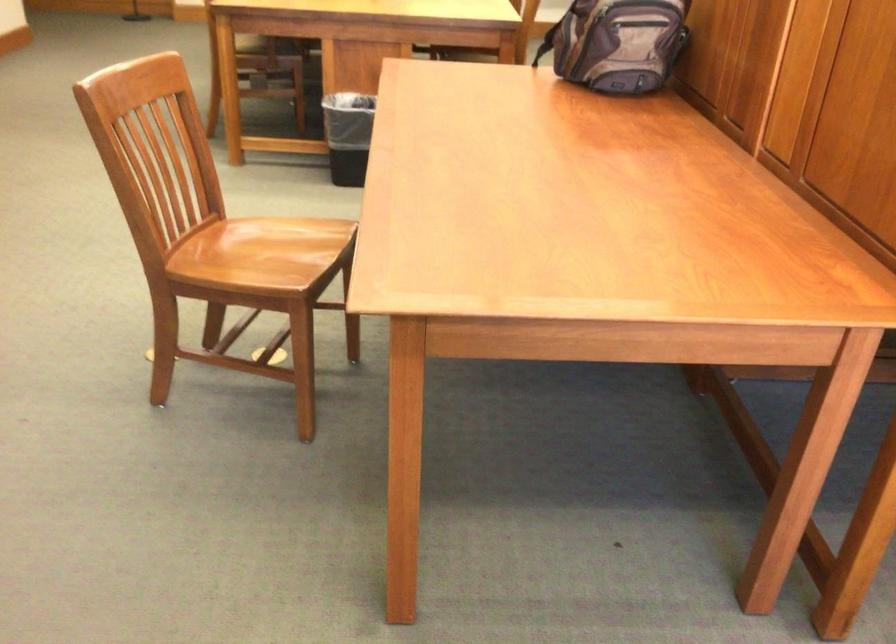
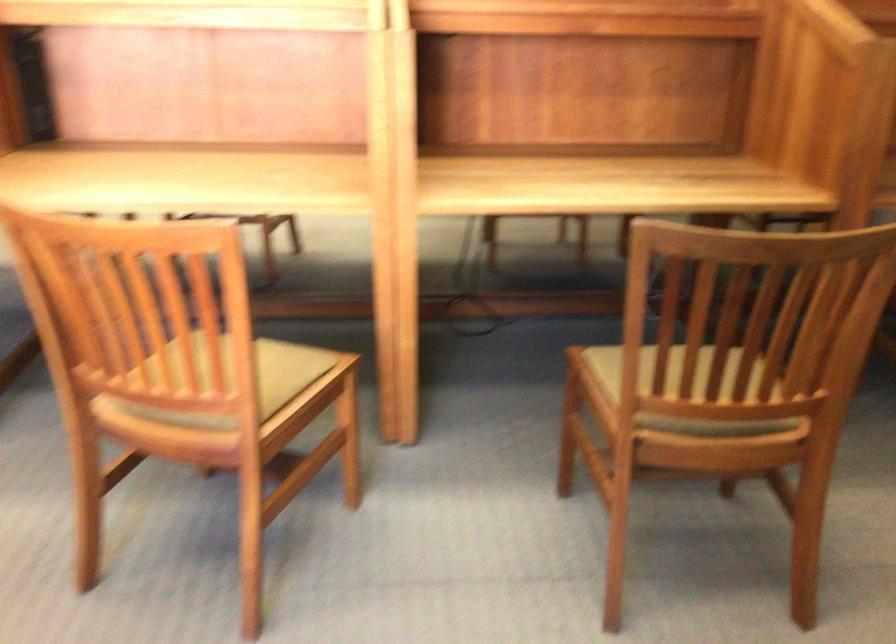
What movement of the cameraman would produce the second image?

The cameraman walked toward right, backward.